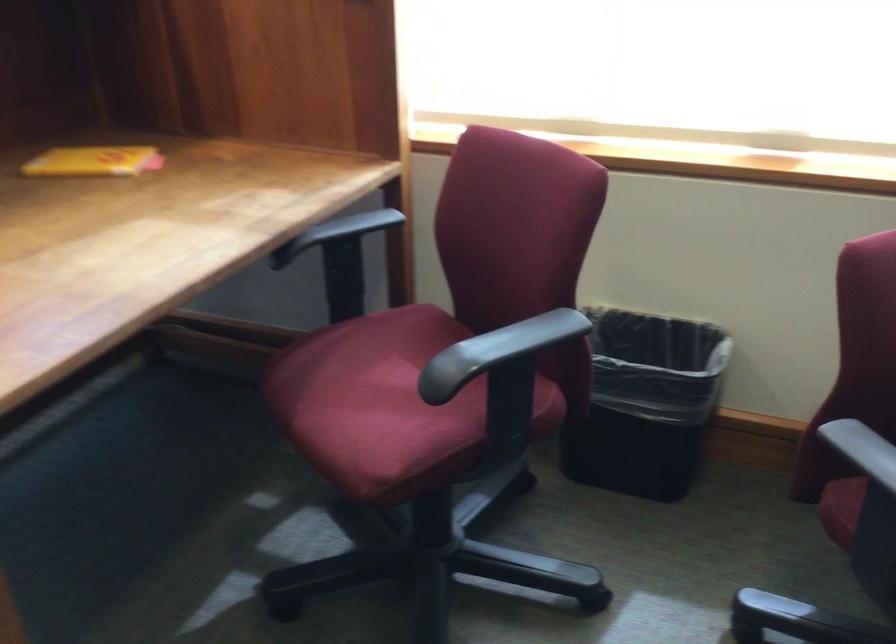
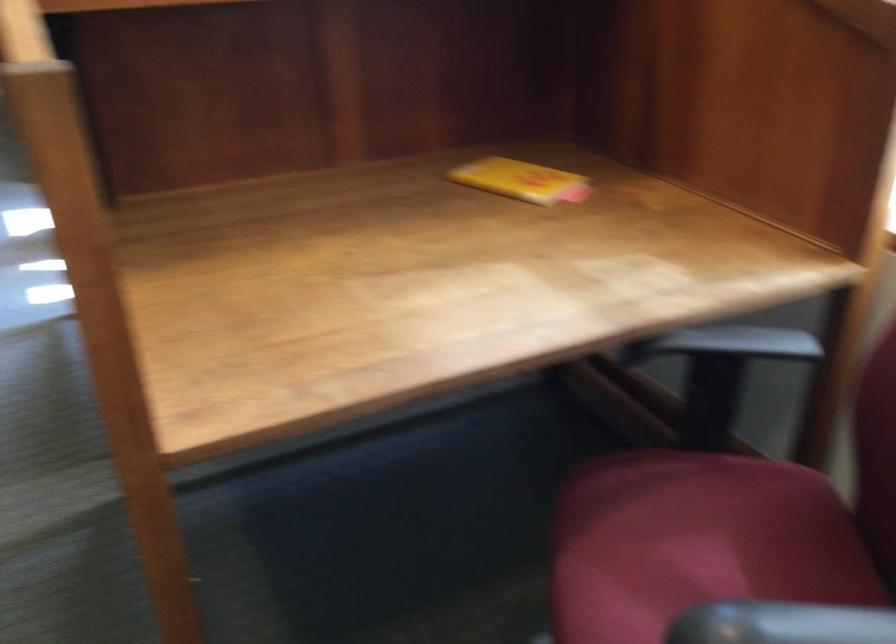
Question: The first image is from the beginning of the video and the second image is from the end. How did the camera likely rotate when shooting the video?

Choices:
 (A) Left
 (B) Right
 (C) Up
 (D) Down

Answer: (A)